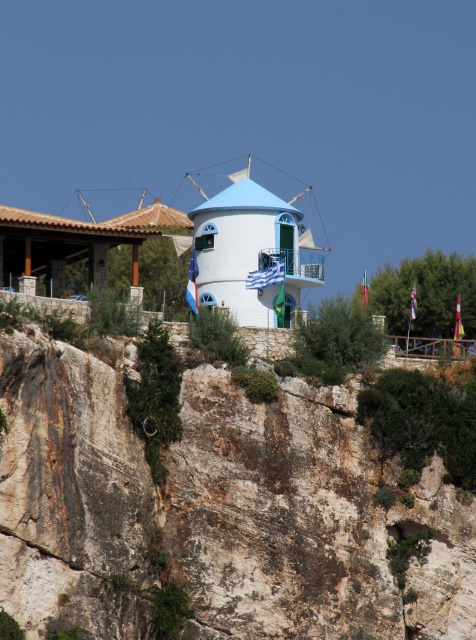
Question: Where is white stone cliff at center located in relation to white matte windmill at center in the image?

Choices:
 (A) left
 (B) right

Answer: (A)

Question: Which point is closer to the camera taking this photo?

Choices:
 (A) (329, 548)
 (B) (277, 257)

Answer: (A)

Question: Which of the following is the closest to the observer?

Choices:
 (A) white stone cliff at center
 (B) white matte windmill at center

Answer: (A)

Question: In this image, where is white stone cliff at center located relative to white matte windmill at center?

Choices:
 (A) left
 (B) right

Answer: (A)

Question: Where is white stone cliff at center located in relation to white matte windmill at center in the image?

Choices:
 (A) left
 (B) right

Answer: (A)